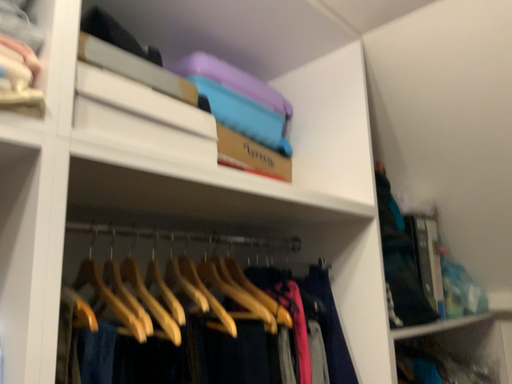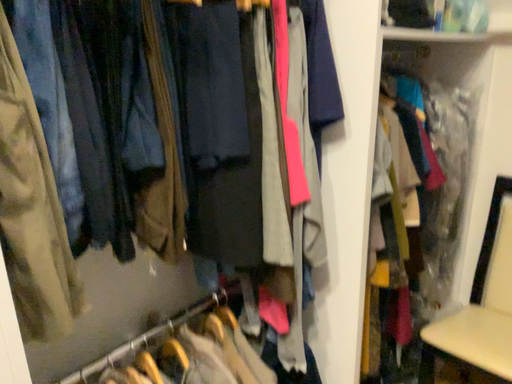
Question: Which way did the camera rotate in the video?

Choices:
 (A) rotated upward
 (B) rotated downward

Answer: (B)